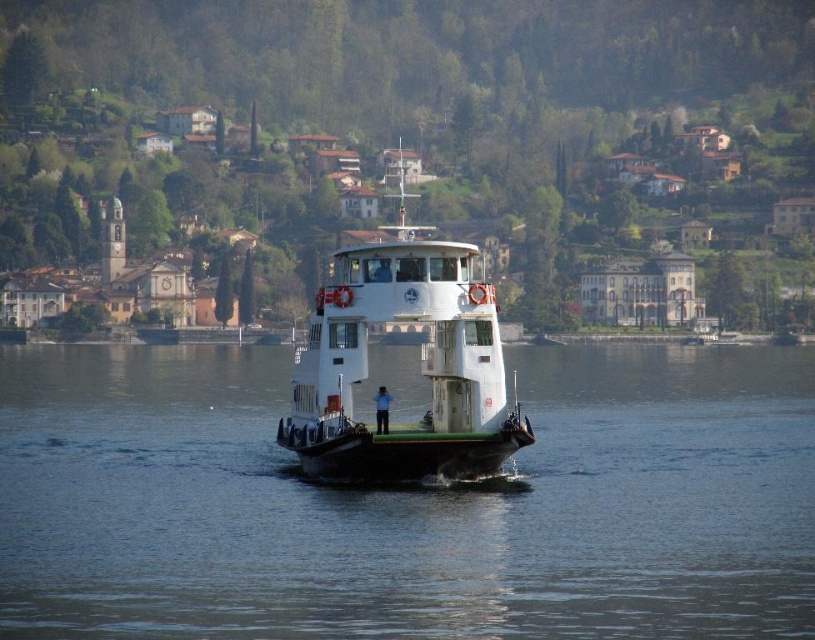
Question: Does clear water at center have a greater width compared to white matte ferryboat at center?

Choices:
 (A) no
 (B) yes

Answer: (B)

Question: Which of the following is the closest to the observer?

Choices:
 (A) white matte ferryboat at center
 (B) clear water at center

Answer: (B)

Question: Which point is farther from the camera taking this photo?

Choices:
 (A) (59, 531)
 (B) (468, 452)

Answer: (B)

Question: Does clear water at center appear on the right side of white matte ferryboat at center?

Choices:
 (A) no
 (B) yes

Answer: (B)

Question: Can you confirm if clear water at center is wider than white matte ferryboat at center?

Choices:
 (A) no
 (B) yes

Answer: (B)